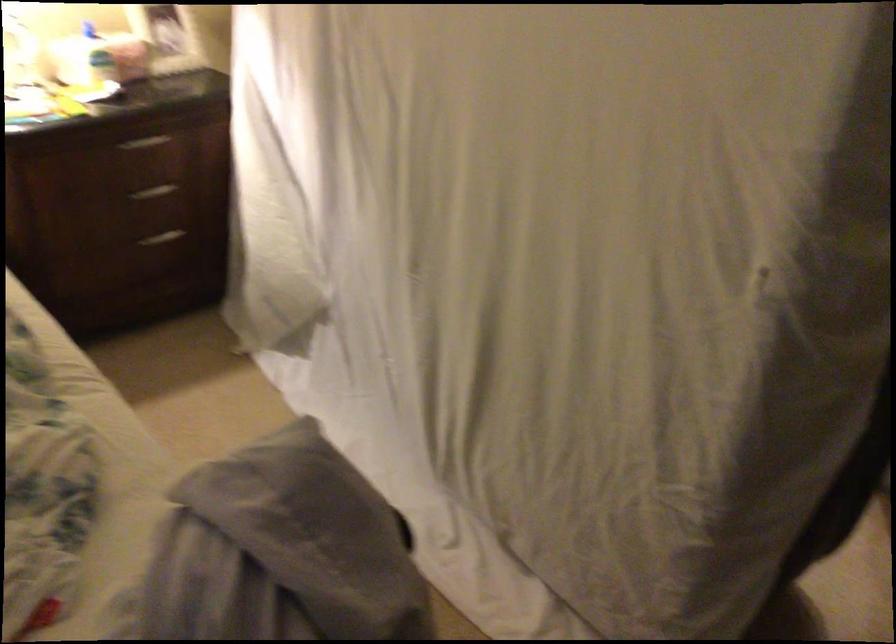
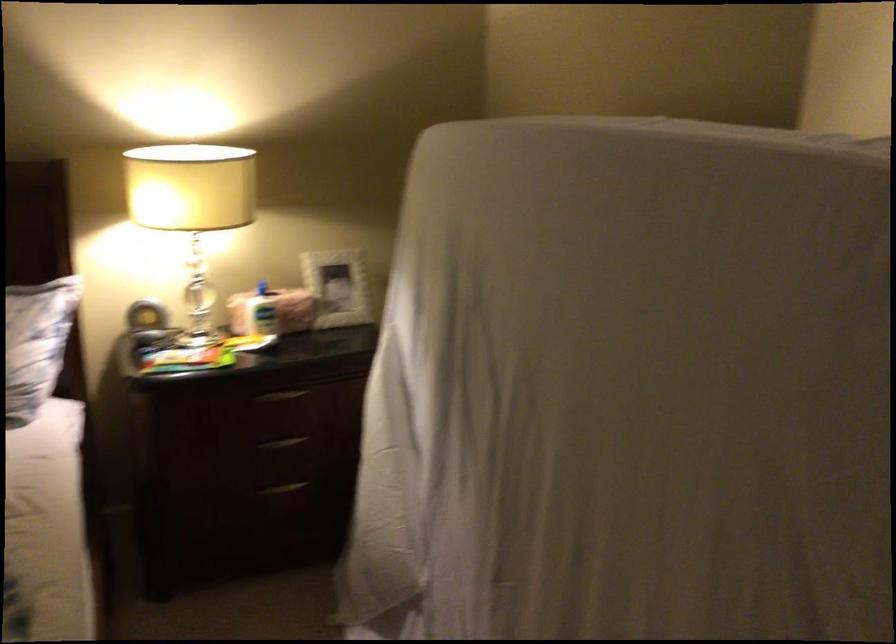
In the second image, find the point that corresponds to the point at 161,240 in the first image.

(283, 488)